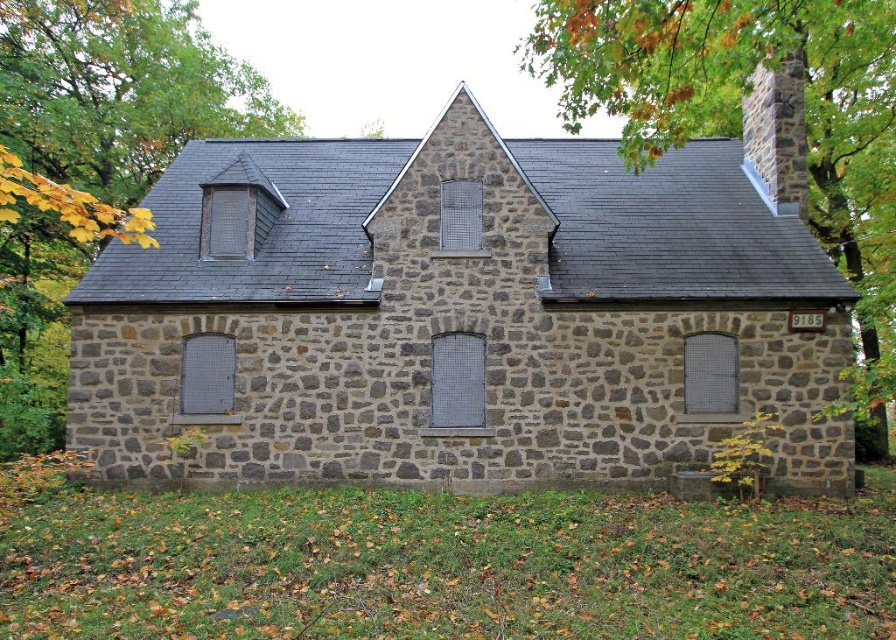
Image resolution: width=896 pixels, height=640 pixels. I want to click on green leafy tree at upper right, so 739,108.

Looking at this image, how much distance is there between green leafy tree at upper right and stone chimney at upper right?

They are 3.71 meters apart.

Which is behind, point (653, 80) or point (755, 122)?

Point (755, 122)

Identify the location of green leafy tree at upper right. The height and width of the screenshot is (640, 896). (739, 108).

The width and height of the screenshot is (896, 640). What do you see at coordinates (457, 317) in the screenshot?
I see `gray stone chapel at center` at bounding box center [457, 317].

Is gray stone chapel at center shorter than stone chimney at upper right?

Incorrect, gray stone chapel at center's height does not fall short of stone chimney at upper right's.

Between point (126, 472) and point (765, 148), which one is positioned behind?

The point (765, 148) is behind.

The height and width of the screenshot is (640, 896). What are the coordinates of `gray stone chapel at center` in the screenshot? It's located at (457, 317).

Is point (346, 369) farther from viewer compared to point (699, 13)?

That is True.

Which is in front, point (748, 304) or point (817, 116)?

Point (748, 304) is in front.

Identify the location of gray stone chapel at center. (457, 317).